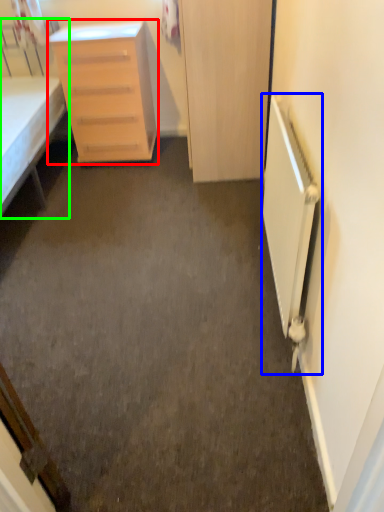
Question: Which object is the closest to the chest of drawers (highlighted by a red box)? Choose among these: radiator (highlighted by a blue box) or bed (highlighted by a green box).

Choices:
 (A) radiator
 (B) bed

Answer: (B)